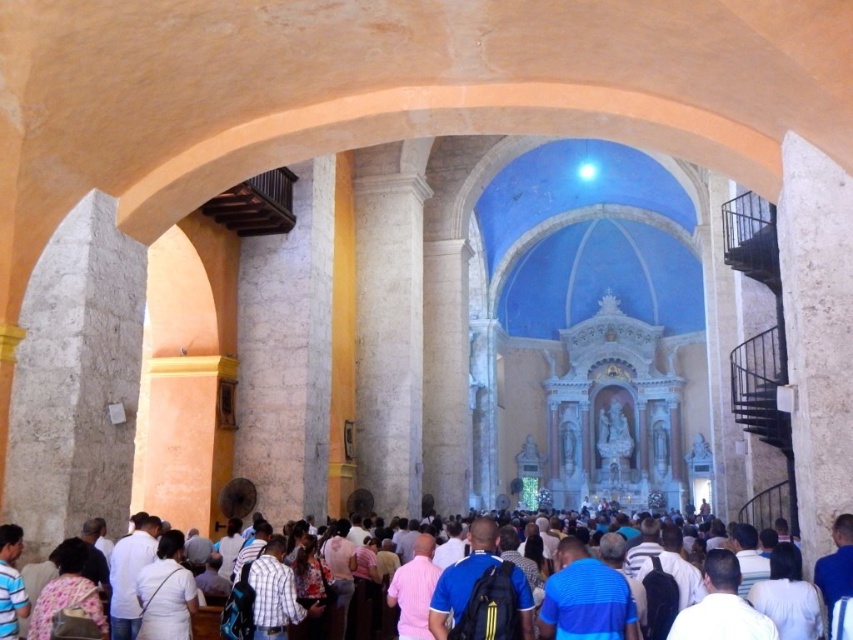
You are a photographer standing at the back of the church. You want to take a photo that includes both the white cotton shirt at center and the white fabric shirt at lower left. Given that your camera has a maximum focus range of 8 meters, will you be able to capture both subjects in focus?

The distance between the white cotton shirt at center and the white fabric shirt at lower left is 7.80 meters, which is within the camera maximum focus range of 8 meters. Therefore, you can capture both subjects in focus.

You are standing in the church and need to hand a pamphlet to the person wearing the white cotton shirt at center. However, there is a light brown leather backpack at lower left blocking your path. Can you reach the person without moving the backpack?

The white cotton shirt at center is positioned under the light brown leather backpack at lower left, meaning the backpack is above it. Since the backpack is at lower left and the shirt is under it, the backpack is likely in front of the shirt, blocking the path. Therefore, you would need to move the backpack to reach the person wearing the white cotton shirt at center.